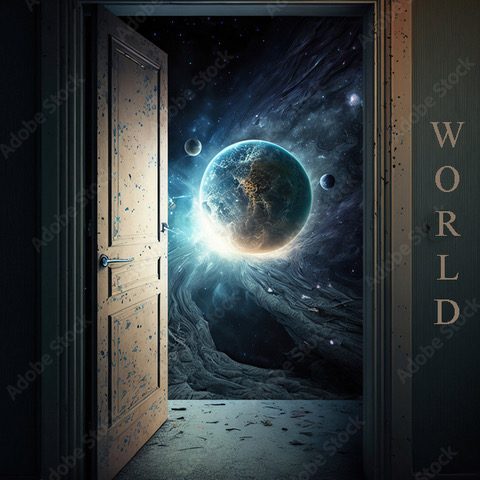
Where is `floor`? floor is located at coordinates (235, 429).